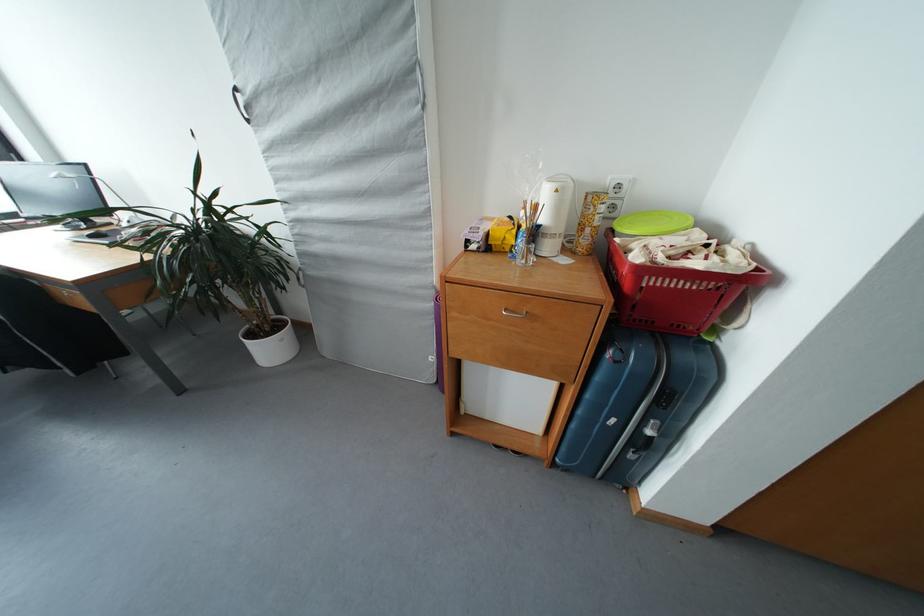
At what (x,y) coordinates should I click in order to perform the action: click on metal drawer handle. Please return your answer as a coordinate pair (x, y). Looking at the image, I should click on (514, 313).